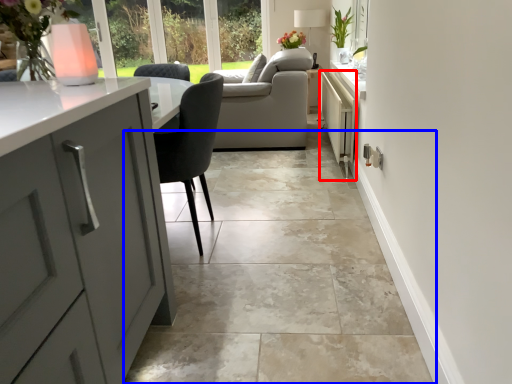
Question: Which of the following is the farthest to the observer, appliance (highlighted by a red box) or ceramic tile (highlighted by a blue box)?

Choices:
 (A) appliance
 (B) ceramic tile

Answer: (A)